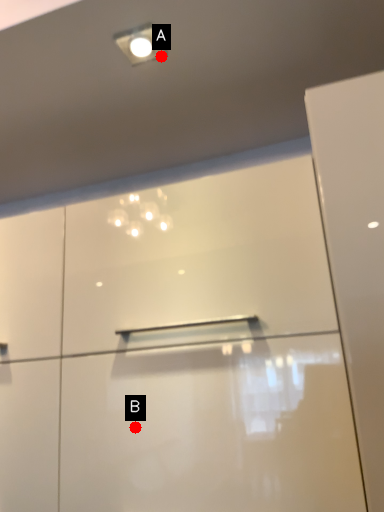
Question: Two points are circled on the image, labeled by A and B beside each circle. Which point is closer to the camera taking this photo?

Choices:
 (A) A is closer
 (B) B is closer

Answer: (B)